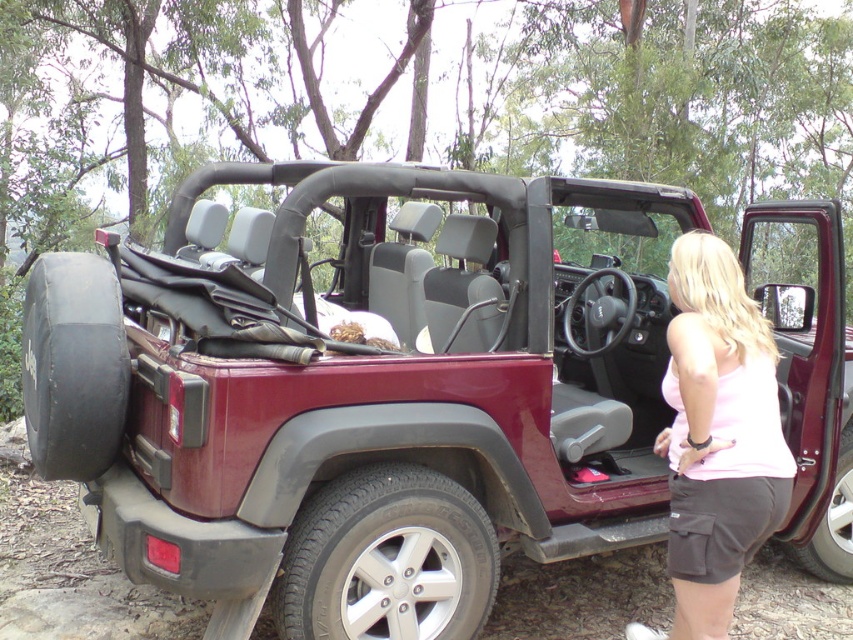
You are a delivery person who needs to place a small package on the roof of the maroon matte jeep at center. The coordinates given are for a point on the jeep. Can you confirm if the point at (360, 394) is on the roof of the maroon matte jeep at center?

The point at (360, 394) is on the maroon matte jeep at center, but the description does not specify if it is on the roof. Therefore, it is uncertain whether the point is on the roof.

You are a photographer trying to capture a clear shot of both the maroon matte jeep at center and the pink cotton tank top at center. Since you want both subjects in focus, which one should you adjust your camera focus on first?

The maroon matte jeep at center is further to the viewer than the pink cotton tank top at center, so you should focus on the jeep first to ensure both are in focus.